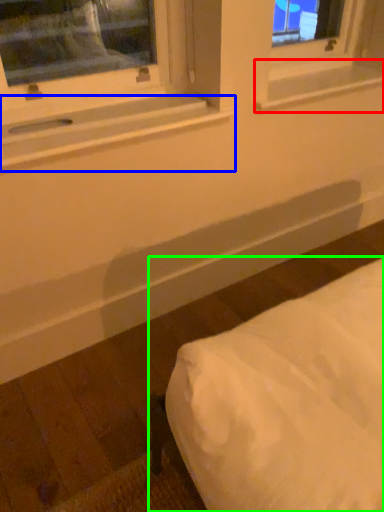
Question: Which object is the closest to the window sill (highlighted by a red box)? Choose among these: window sill (highlighted by a blue box) or furniture (highlighted by a green box).

Choices:
 (A) window sill
 (B) furniture

Answer: (A)